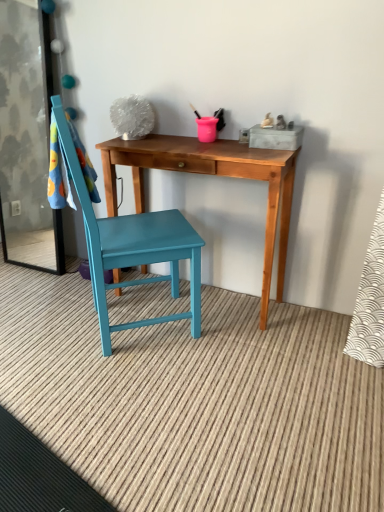
You are a GUI agent. You are given a task and a screenshot of the screen. Output one action in this format:
    pyautogui.click(x=<x>, y=<y>)
    Task: Click on the space that is in front of teal painted wood chair at center
    The height and width of the screenshot is (512, 384).
    Given the screenshot: What is the action you would take?
    pyautogui.click(x=131, y=389)